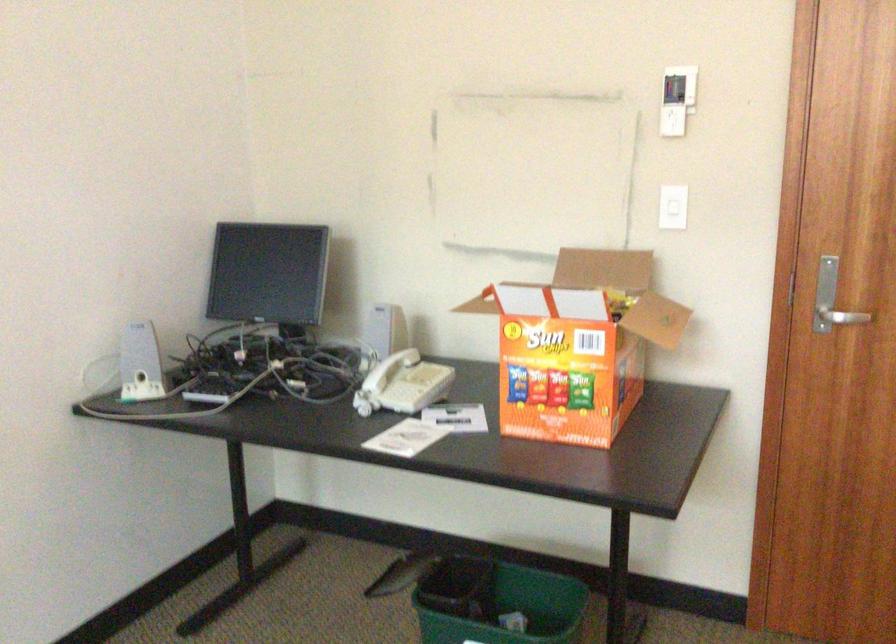
What do you see at coordinates (672, 214) in the screenshot?
I see `the white light switch` at bounding box center [672, 214].